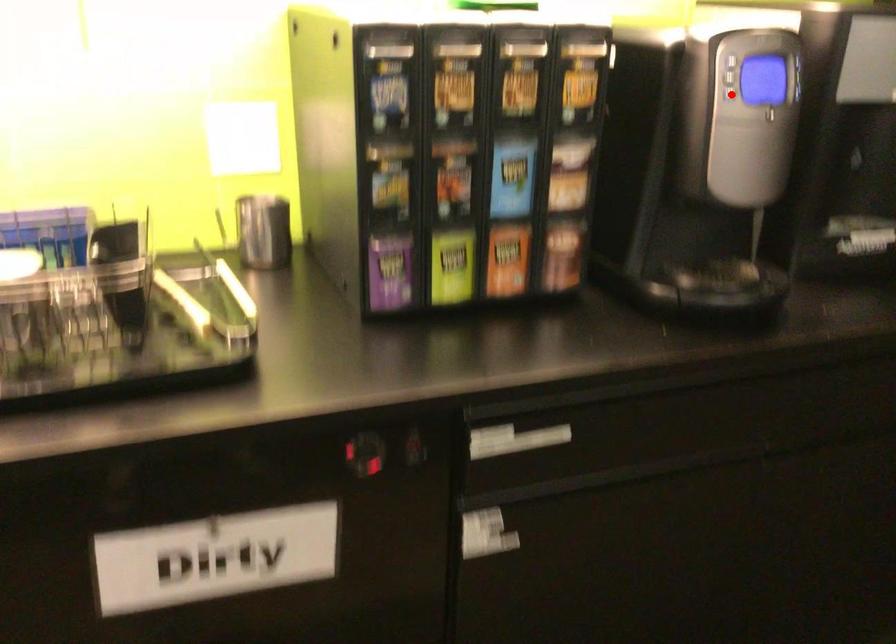
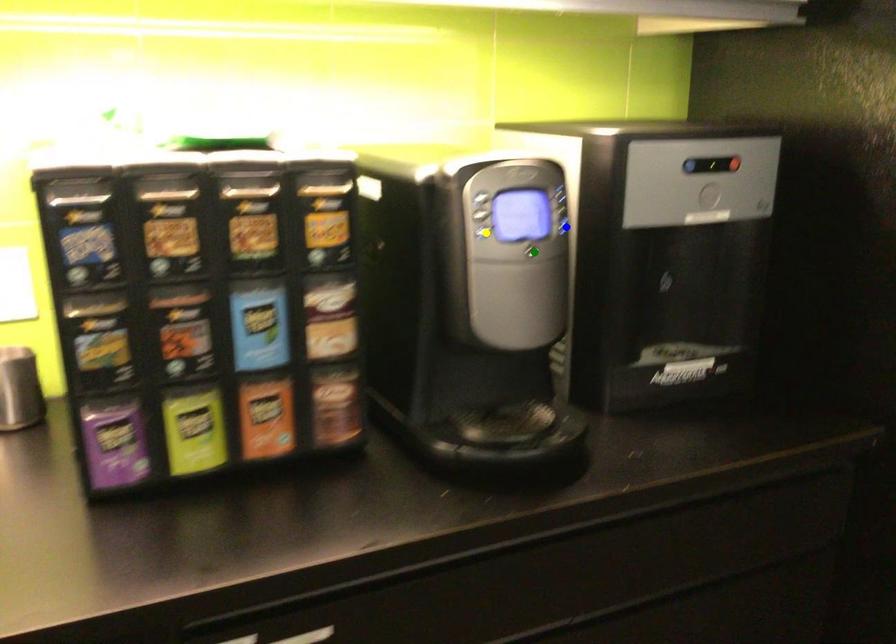
Question: I am providing you with two images of the same scene from different viewpoints. A red point is marked on the first image. You are given multiple points on the second image. Which point in image 2 represents the same 3d spot as the red point in image 1?

Choices:
 (A) yellow point
 (B) blue point
 (C) green point

Answer: (A)